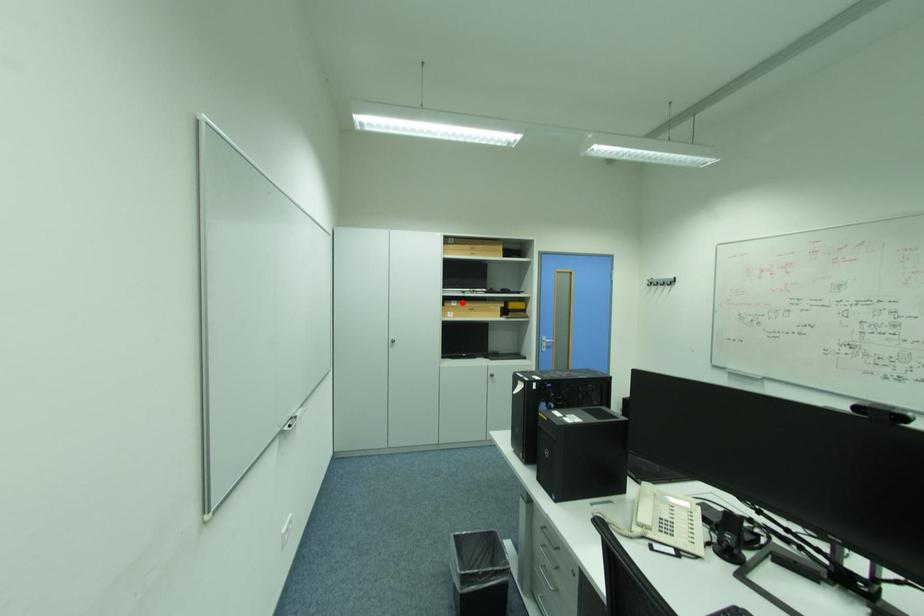
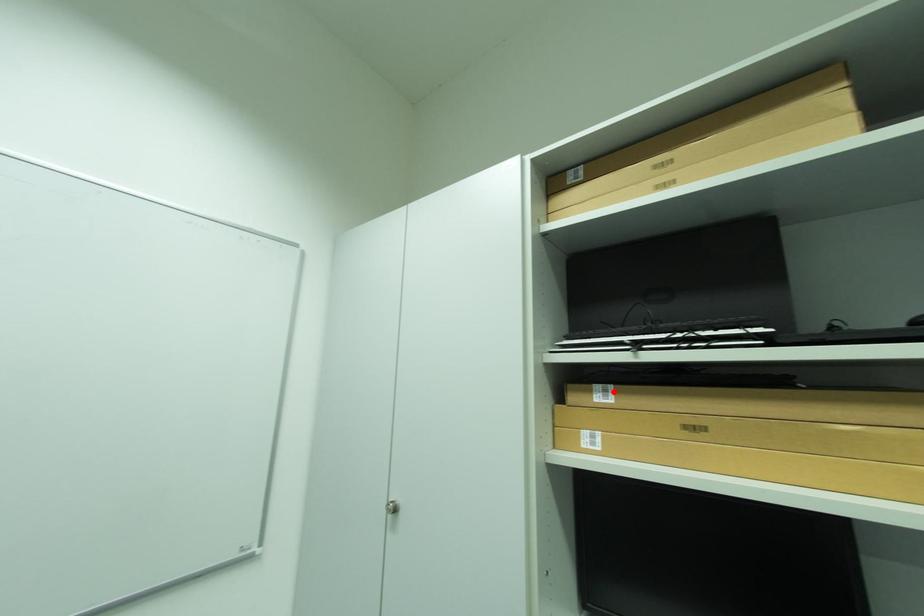
I am providing you with two images of the same scene from different viewpoints. A red point is marked on the first image and another point is marked on the second image. Are the points marked in image1 and image2 representing the same 3D position?

Yes